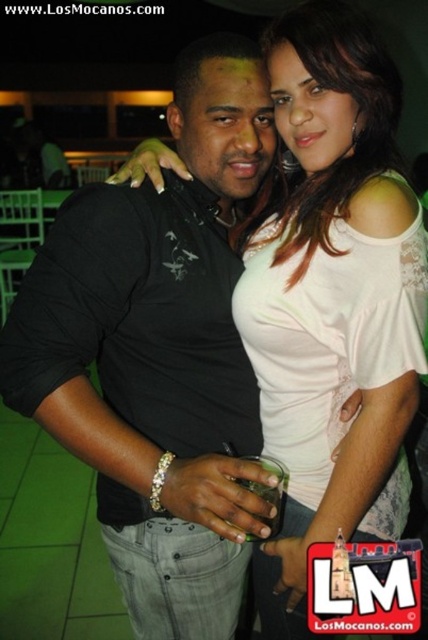
Question: Which object is farther from the camera taking this photo?

Choices:
 (A) white lace top at center
 (B) black matte shirt at center

Answer: (A)

Question: Can you confirm if black matte shirt at center is bigger than white lace top at center?

Choices:
 (A) no
 (B) yes

Answer: (B)

Question: Which object is closer to the camera taking this photo?

Choices:
 (A) black matte shirt at center
 (B) white lace top at center

Answer: (A)

Question: Is black matte shirt at center smaller than white lace top at center?

Choices:
 (A) no
 (B) yes

Answer: (A)

Question: Can you confirm if black matte shirt at center is smaller than white lace top at center?

Choices:
 (A) yes
 (B) no

Answer: (B)